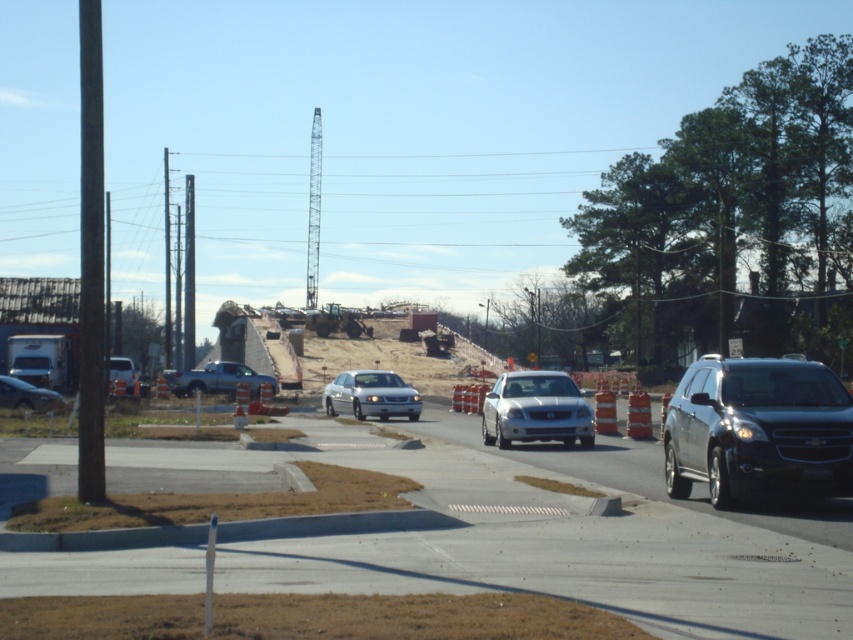
Question: Which object is positioned closest to the silver metallic truck at center?

Choices:
 (A) orange traffic cones at center
 (B) matte silver sedan at left
 (C) shiny silver sedan at lower left
 (D) satin silver sedan at center

Answer: (B)

Question: Which point is closer to the camera?

Choices:
 (A) silver metallic sedan at center
 (B) shiny silver sedan at lower left
 (C) silver metallic truck at center
 (D) orange traffic cones at center

Answer: (D)

Question: Can you confirm if satin silver sedan at center is positioned above shiny silver sedan at lower left?

Choices:
 (A) no
 (B) yes

Answer: (B)

Question: Can you confirm if orange traffic cones at center is positioned to the right of silver metallic sedan at center?

Choices:
 (A) no
 (B) yes

Answer: (A)

Question: Is satin silver sedan at center positioned behind silver metallic truck at center?

Choices:
 (A) yes
 (B) no

Answer: (B)

Question: Which object is farther from the camera taking this photo?

Choices:
 (A) satin silver sedan at center
 (B) orange traffic cones at center

Answer: (A)